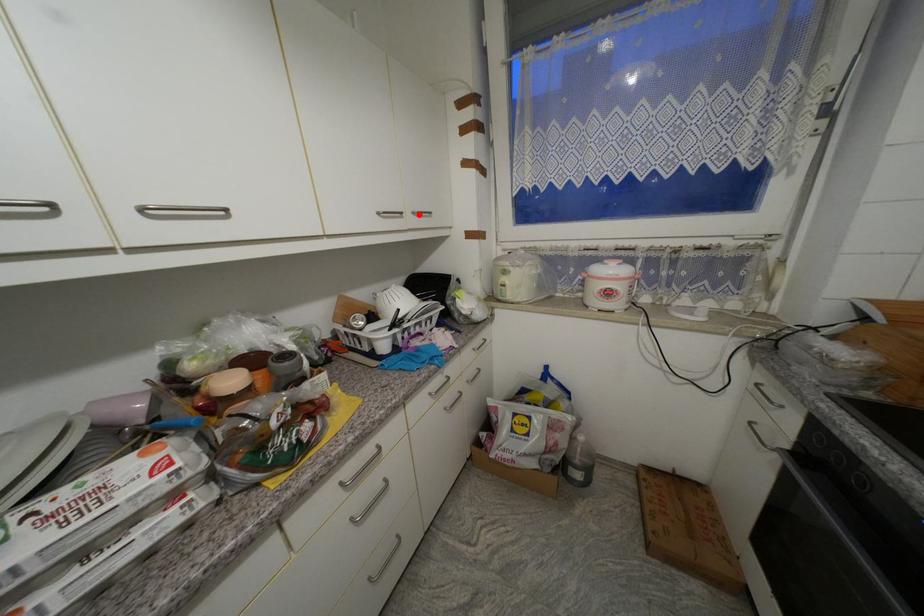
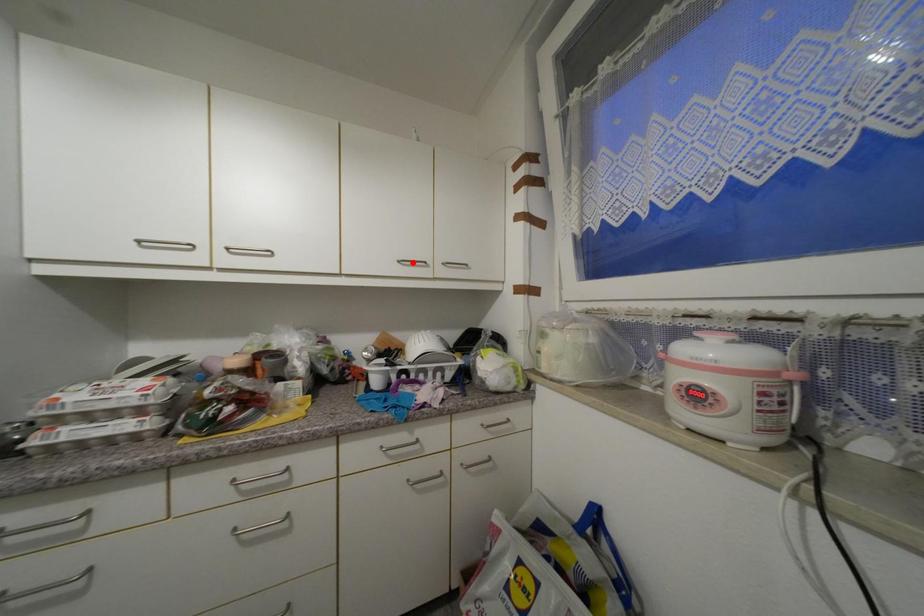
I am providing you with two images of the same scene from different viewpoints. A red point is marked on the first image and another point is marked on the second image. Do the highlighted points in image1 and image2 indicate the same real-world spot?

No